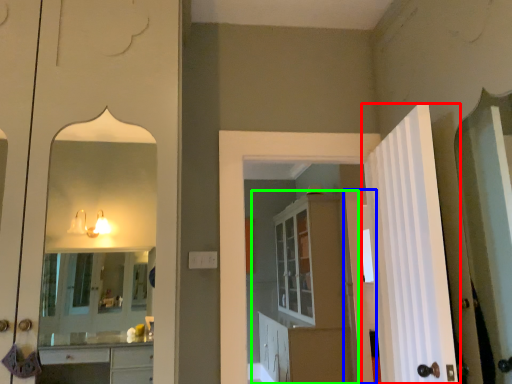
Question: Which object is positioned farthest from door (highlighted by a red box)? Select from door (highlighted by a blue box) and dresser (highlighted by a green box).

Choices:
 (A) door
 (B) dresser

Answer: (B)